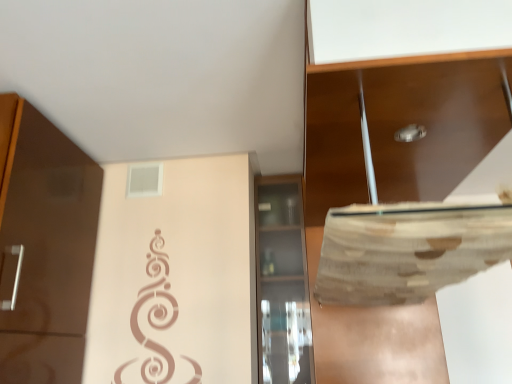
Image resolution: width=512 pixels, height=384 pixels. In order to click on transparent glass cabinet at center, which appears as the 1th cabinetry when ordered from the bottom in this screenshot , I will do coord(282,283).

In order to face transparent glass cabinet at center, marked as the second cabinetry in a top-to-bottom arrangement, should I rotate leftwards or rightwards?

Rotate right and turn 3.938 degrees.

The image size is (512, 384). What do you see at coordinates (282, 283) in the screenshot? I see `transparent glass cabinet at center, which appears as the 1th cabinetry when ordered from the bottom` at bounding box center [282, 283].

Describe the element at coordinates (433, 120) in the screenshot. I see `matte brown cabinet at upper right, which is counted as the first cabinetry, starting from the top` at that location.

Identify the location of matte brown cabinet at upper right, which is the 2th cabinetry in bottom-to-top order. (433, 120).

What are the coordinates of `transparent glass cabinet at center, marked as the second cabinetry in a top-to-bottom arrangement` in the screenshot? It's located at (282, 283).

Can you confirm if transparent glass cabinet at center, which appears as the 1th cabinetry when ordered from the bottom, is positioned to the left of matte brown cabinet at upper right, which is the 2th cabinetry in bottom-to-top order?

Yes.

Between transparent glass cabinet at center, which appears as the 1th cabinetry when ordered from the bottom, and matte brown cabinet at upper right, which is the 2th cabinetry in bottom-to-top order, which one is positioned in front?

matte brown cabinet at upper right, which is the 2th cabinetry in bottom-to-top order, is in front.

Is point (287, 331) more distant than point (488, 98)?

Yes.

Based on the photo, from the image's perspective, is transparent glass cabinet at center, which appears as the 1th cabinetry when ordered from the bottom, above matte brown cabinet at upper right, which is counted as the first cabinetry, starting from the top?

No.

From a real-world perspective, who is located lower, transparent glass cabinet at center, which appears as the 1th cabinetry when ordered from the bottom, or matte brown cabinet at upper right, which is the 2th cabinetry in bottom-to-top order?

transparent glass cabinet at center, which appears as the 1th cabinetry when ordered from the bottom, from a real-world perspective.

Between transparent glass cabinet at center, marked as the second cabinetry in a top-to-bottom arrangement, and matte brown cabinet at upper right, which is counted as the first cabinetry, starting from the top, which one has smaller width?

transparent glass cabinet at center, marked as the second cabinetry in a top-to-bottom arrangement.

Does transparent glass cabinet at center, which appears as the 1th cabinetry when ordered from the bottom, have a greater height compared to matte brown cabinet at upper right, which is counted as the first cabinetry, starting from the top?

Correct, transparent glass cabinet at center, which appears as the 1th cabinetry when ordered from the bottom, is much taller as matte brown cabinet at upper right, which is counted as the first cabinetry, starting from the top.

Between transparent glass cabinet at center, marked as the second cabinetry in a top-to-bottom arrangement, and matte brown cabinet at upper right, which is the 2th cabinetry in bottom-to-top order, which one has larger size?

matte brown cabinet at upper right, which is the 2th cabinetry in bottom-to-top order.

Could matte brown cabinet at upper right, which is counted as the first cabinetry, starting from the top, be considered to be inside transparent glass cabinet at center, marked as the second cabinetry in a top-to-bottom arrangement?

No, transparent glass cabinet at center, marked as the second cabinetry in a top-to-bottom arrangement, does not contain matte brown cabinet at upper right, which is counted as the first cabinetry, starting from the top.

Would you say transparent glass cabinet at center, which appears as the 1th cabinetry when ordered from the bottom, is a long distance from matte brown cabinet at upper right, which is counted as the first cabinetry, starting from the top?

They are positioned close to each other.

Is transparent glass cabinet at center, marked as the second cabinetry in a top-to-bottom arrangement, facing towards matte brown cabinet at upper right, which is the 2th cabinetry in bottom-to-top order?

No, transparent glass cabinet at center, marked as the second cabinetry in a top-to-bottom arrangement, is not aimed at matte brown cabinet at upper right, which is the 2th cabinetry in bottom-to-top order.

How far apart are transparent glass cabinet at center, which appears as the 1th cabinetry when ordered from the bottom, and matte brown cabinet at upper right, which is the 2th cabinetry in bottom-to-top order?

They are 30.01 inches apart.

At what (x,y) coordinates should I click in order to perform the action: click on cabinetry below the matte brown cabinet at upper right, which is the 2th cabinetry in bottom-to-top order (from the image's perspective). Please return your answer as a coordinate pair (x, y). The height and width of the screenshot is (384, 512). Looking at the image, I should click on pyautogui.click(x=282, y=283).

Is matte brown cabinet at upper right, which is counted as the first cabinetry, starting from the top, at the left side of transparent glass cabinet at center, which appears as the 1th cabinetry when ordered from the bottom?

In fact, matte brown cabinet at upper right, which is counted as the first cabinetry, starting from the top, is to the right of transparent glass cabinet at center, which appears as the 1th cabinetry when ordered from the bottom.

Considering the positions of objects matte brown cabinet at upper right, which is the 2th cabinetry in bottom-to-top order, and transparent glass cabinet at center, marked as the second cabinetry in a top-to-bottom arrangement, in the image provided, who is behind, matte brown cabinet at upper right, which is the 2th cabinetry in bottom-to-top order, or transparent glass cabinet at center, marked as the second cabinetry in a top-to-bottom arrangement,?

transparent glass cabinet at center, marked as the second cabinetry in a top-to-bottom arrangement, is behind.

Is point (346, 181) behind point (258, 269)?

No, (346, 181) is in front of (258, 269).

From the picture: From the image's perspective, is matte brown cabinet at upper right, which is the 2th cabinetry in bottom-to-top order, located beneath transparent glass cabinet at center, which appears as the 1th cabinetry when ordered from the bottom?

Incorrect, from the image's perspective, matte brown cabinet at upper right, which is the 2th cabinetry in bottom-to-top order, is higher than transparent glass cabinet at center, which appears as the 1th cabinetry when ordered from the bottom.

From a real-world perspective, between matte brown cabinet at upper right, which is the 2th cabinetry in bottom-to-top order, and transparent glass cabinet at center, which appears as the 1th cabinetry when ordered from the bottom, who is vertically lower?

transparent glass cabinet at center, which appears as the 1th cabinetry when ordered from the bottom, is physically lower.

Looking at their sizes, would you say matte brown cabinet at upper right, which is counted as the first cabinetry, starting from the top, is wider or thinner than transparent glass cabinet at center, which appears as the 1th cabinetry when ordered from the bottom?

In the image, matte brown cabinet at upper right, which is counted as the first cabinetry, starting from the top, appears to be wider than transparent glass cabinet at center, which appears as the 1th cabinetry when ordered from the bottom.

Considering the sizes of matte brown cabinet at upper right, which is counted as the first cabinetry, starting from the top, and transparent glass cabinet at center, which appears as the 1th cabinetry when ordered from the bottom, in the image, is matte brown cabinet at upper right, which is counted as the first cabinetry, starting from the top, taller or shorter than transparent glass cabinet at center, which appears as the 1th cabinetry when ordered from the bottom,?

Considering their sizes, matte brown cabinet at upper right, which is counted as the first cabinetry, starting from the top, has less height than transparent glass cabinet at center, which appears as the 1th cabinetry when ordered from the bottom.

Does matte brown cabinet at upper right, which is the 2th cabinetry in bottom-to-top order, have a larger size compared to transparent glass cabinet at center, which appears as the 1th cabinetry when ordered from the bottom?

Indeed, matte brown cabinet at upper right, which is the 2th cabinetry in bottom-to-top order, has a larger size compared to transparent glass cabinet at center, which appears as the 1th cabinetry when ordered from the bottom.

Is matte brown cabinet at upper right, which is the 2th cabinetry in bottom-to-top order, outside of transparent glass cabinet at center, which appears as the 1th cabinetry when ordered from the bottom?

matte brown cabinet at upper right, which is the 2th cabinetry in bottom-to-top order, lies outside transparent glass cabinet at center, which appears as the 1th cabinetry when ordered from the bottom,'s area.

From the picture: Is matte brown cabinet at upper right, which is counted as the first cabinetry, starting from the top, next to transparent glass cabinet at center, which appears as the 1th cabinetry when ordered from the bottom?

No, matte brown cabinet at upper right, which is counted as the first cabinetry, starting from the top, is not with transparent glass cabinet at center, which appears as the 1th cabinetry when ordered from the bottom.

Could you tell me if matte brown cabinet at upper right, which is counted as the first cabinetry, starting from the top, is facing transparent glass cabinet at center, marked as the second cabinetry in a top-to-bottom arrangement?

No.

How many degrees apart are the facing directions of matte brown cabinet at upper right, which is the 2th cabinetry in bottom-to-top order, and transparent glass cabinet at center, marked as the second cabinetry in a top-to-bottom arrangement?

90 degrees.

Find the location of a particular element. cabinetry behind the matte brown cabinet at upper right, which is the 2th cabinetry in bottom-to-top order is located at coordinates (282, 283).

There is a transparent glass cabinet at center, marked as the second cabinetry in a top-to-bottom arrangement. Identify the location of cabinetry above it (from a real-world perspective). (433, 120).

This screenshot has width=512, height=384. In order to click on cabinetry located on the left of matte brown cabinet at upper right, which is the 2th cabinetry in bottom-to-top order in this screenshot , I will do `click(282, 283)`.